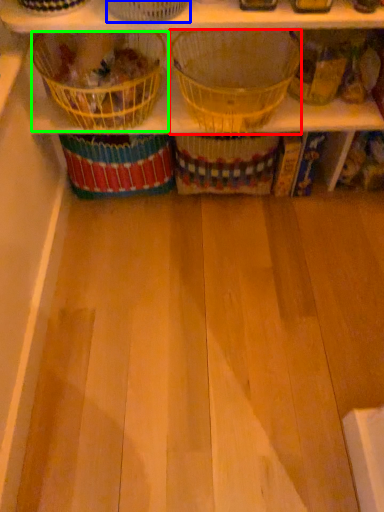
Question: Estimate the real-world distances between objects in this image. Which object is closer to basket (highlighted by a red box), basket (highlighted by a blue box) or basket (highlighted by a green box)?

Choices:
 (A) basket
 (B) basket

Answer: (B)